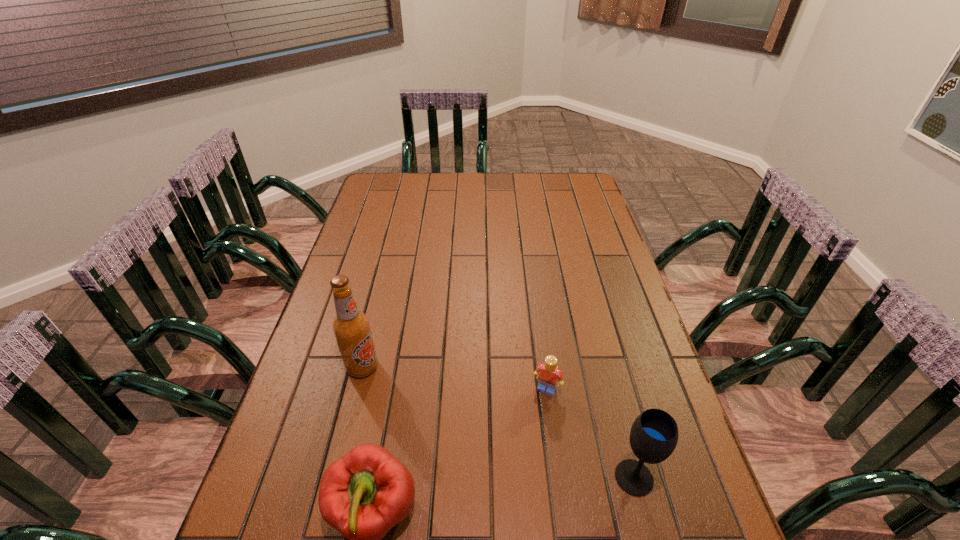
Where is `vacant region located on the front label of the beer bottle`? Image resolution: width=960 pixels, height=540 pixels. vacant region located on the front label of the beer bottle is located at coordinates (464, 447).

At what (x,y) coordinates should I click in order to perform the action: click on free space located 0.190m on the front label of the beer bottle. Please return your answer as a coordinate pair (x, y). This screenshot has width=960, height=540. Looking at the image, I should click on (427, 418).

This screenshot has height=540, width=960. Identify the location of object at the near edge. (654, 434).

Identify the location of object located at the left edge. Image resolution: width=960 pixels, height=540 pixels. (351, 327).

Where is `object situated at the right edge`? The image size is (960, 540). object situated at the right edge is located at coordinates (654, 434).

This screenshot has height=540, width=960. What are the coordinates of `object situated at the near right corner` in the screenshot? It's located at (654, 434).

In the image, there is a desktop. At what (x,y) coordinates should I click in order to perform the action: click on free space at the far edge. Please return your answer as a coordinate pair (x, y). The height and width of the screenshot is (540, 960). Looking at the image, I should click on (534, 193).

Find the location of a particular element. free space at the left edge of the desktop is located at coordinates (279, 431).

The height and width of the screenshot is (540, 960). In the image, there is a desktop. In order to click on vacant region at the right edge in this screenshot , I will do `click(573, 257)`.

I want to click on vacant area at the near left corner, so click(x=297, y=511).